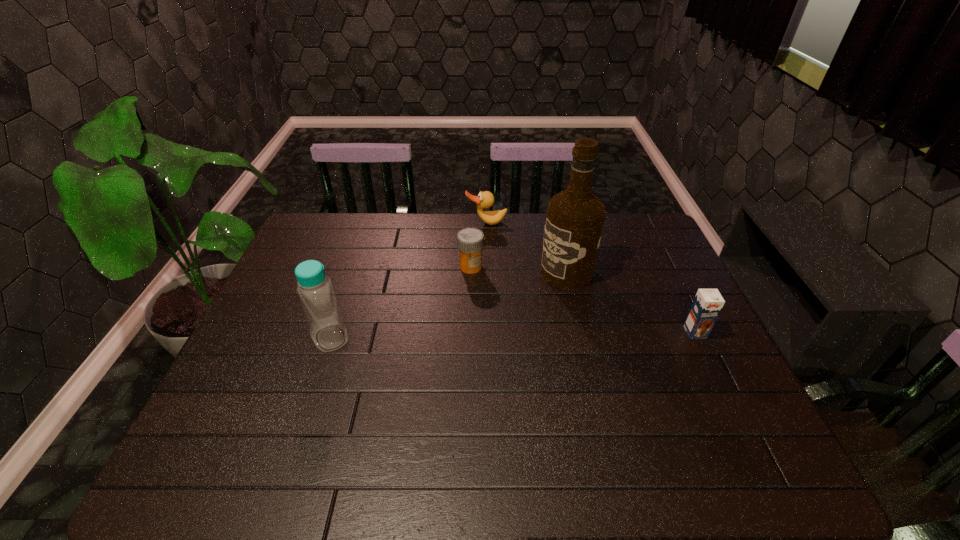
Where is `bottle`? The height and width of the screenshot is (540, 960). bottle is located at coordinates (315, 290).

Image resolution: width=960 pixels, height=540 pixels. I want to click on the second tallest object, so click(x=315, y=290).

Locate an element on the screen. The image size is (960, 540). the rightmost object is located at coordinates (707, 304).

The height and width of the screenshot is (540, 960). What are the coordinates of `the fourth object from left to right` in the screenshot? It's located at (574, 222).

Locate an element on the screen. The image size is (960, 540). the tallest object is located at coordinates (574, 222).

Identify the location of the farthest object. The height and width of the screenshot is (540, 960). (485, 199).

You are a GUI agent. You are given a task and a screenshot of the screen. Output one action in this format:
    pyautogui.click(x=<x>, y=<y>)
    Task: Click on the medicine
    
    Given the screenshot: What is the action you would take?
    pyautogui.click(x=470, y=241)

At what (x,y) coordinates should I click in order to perform the action: click on free point located on the right of the bottle. Please return your answer as a coordinate pair (x, y). Looking at the image, I should click on (445, 338).

Identify the location of free space located 0.240m on the front label of the rightmost object. Image resolution: width=960 pixels, height=540 pixels. (738, 421).

Image resolution: width=960 pixels, height=540 pixels. What are the coordinates of `blank space located 0.350m on the label of the fourth object from left to right` in the screenshot? It's located at (455, 339).